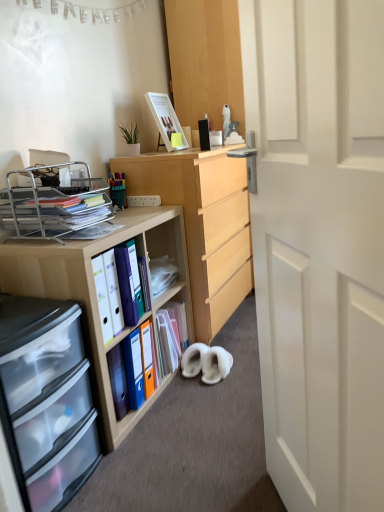
The width and height of the screenshot is (384, 512). I want to click on free space to the left of white fluffy slippers at lower center, acting as the 2th footwear starting from the left, so click(178, 386).